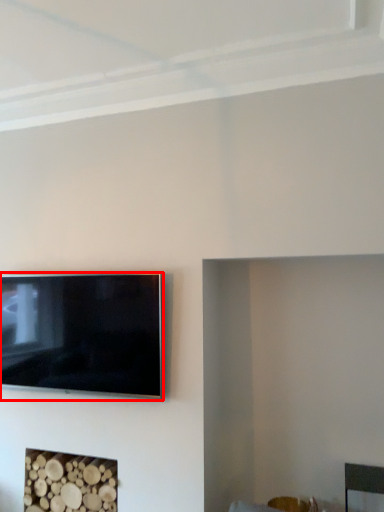
Question: From the image's perspective, where is television (annotated by the red box) located relative to fireplace?

Choices:
 (A) above
 (B) below

Answer: (A)